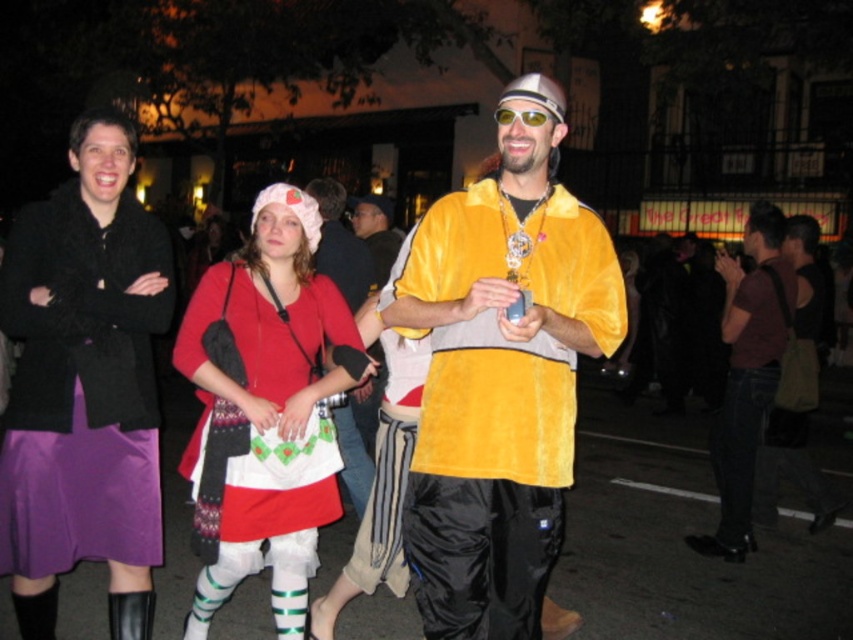
Question: Does matte red dress at center appear over maroon fabric shirt at center?

Choices:
 (A) no
 (B) yes

Answer: (A)

Question: Does velvet gold cape at center appear over purple satin skirt at center?

Choices:
 (A) no
 (B) yes

Answer: (B)

Question: Which point appears closest to the camera in this image?

Choices:
 (A) pyautogui.click(x=352, y=472)
 (B) pyautogui.click(x=496, y=113)
 (C) pyautogui.click(x=775, y=316)

Answer: (B)

Question: Which of the following is the farthest from the observer?

Choices:
 (A) velvet gold cape at center
 (B) purple satin skirt at center

Answer: (B)

Question: Does velvet gold cape at center appear on the right side of gold reflective sunglasses at center?

Choices:
 (A) no
 (B) yes

Answer: (A)

Question: Among these points, which one is farthest from the camera?

Choices:
 (A) (572, 230)
 (B) (517, 112)
 (C) (79, 529)
 (D) (367, 385)

Answer: (D)